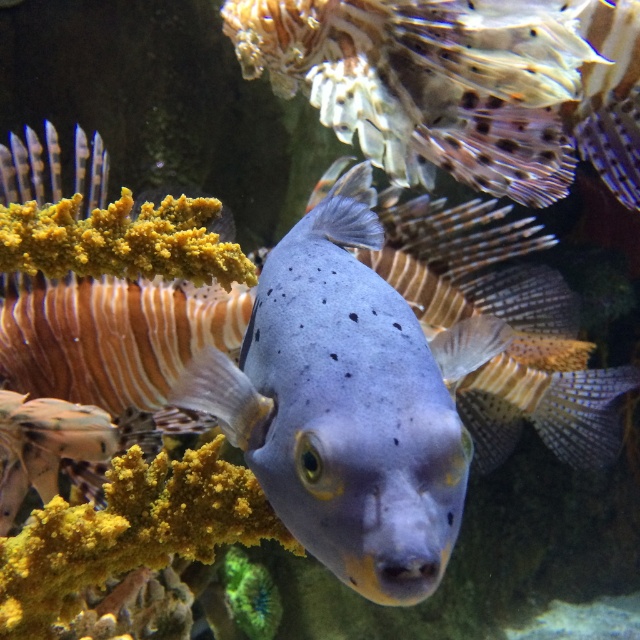
Question: Does matte blue fish at center have a greater width compared to smooth blue fish at center?

Choices:
 (A) no
 (B) yes

Answer: (A)

Question: Is smooth blue fish at center in front of satin blue fish at center?

Choices:
 (A) no
 (B) yes

Answer: (B)

Question: Which object is closer to the camera taking this photo?

Choices:
 (A) satin blue fish at center
 (B) smooth blue fish at center

Answer: (B)

Question: Which point is closer to the camera?

Choices:
 (A) (356, 44)
 (B) (410, 301)

Answer: (A)

Question: Does matte blue fish at center have a larger size compared to smooth blue fish at center?

Choices:
 (A) no
 (B) yes

Answer: (A)

Question: Estimate the real-world distances between objects in this image. Which object is farther from the matte blue fish at center?

Choices:
 (A) satin blue fish at center
 (B) smooth blue fish at center

Answer: (A)